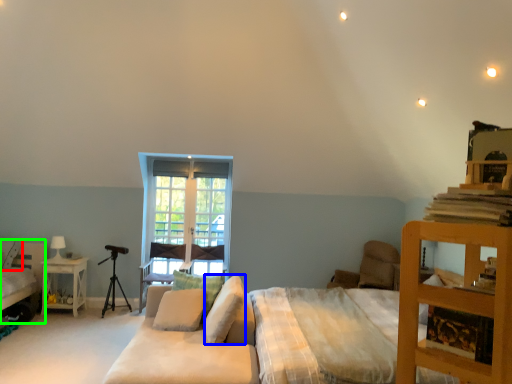
Question: Based on their relative distances, which object is nearer to pillow (highlighted by a red box)? Choose from pillow (highlighted by a blue box) and bed (highlighted by a green box).

Choices:
 (A) pillow
 (B) bed

Answer: (B)